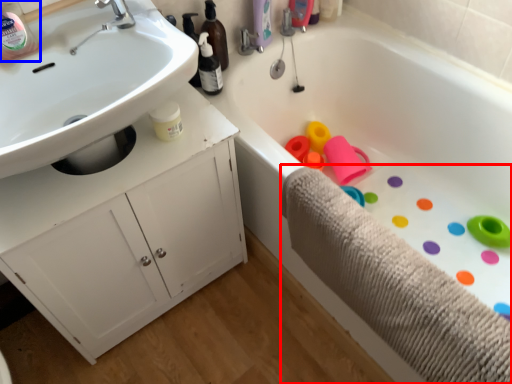
Question: Which point is closer to the camera, bath towel (highlighted by a red box) or bottle (highlighted by a blue box)?

Choices:
 (A) bath towel
 (B) bottle

Answer: (A)